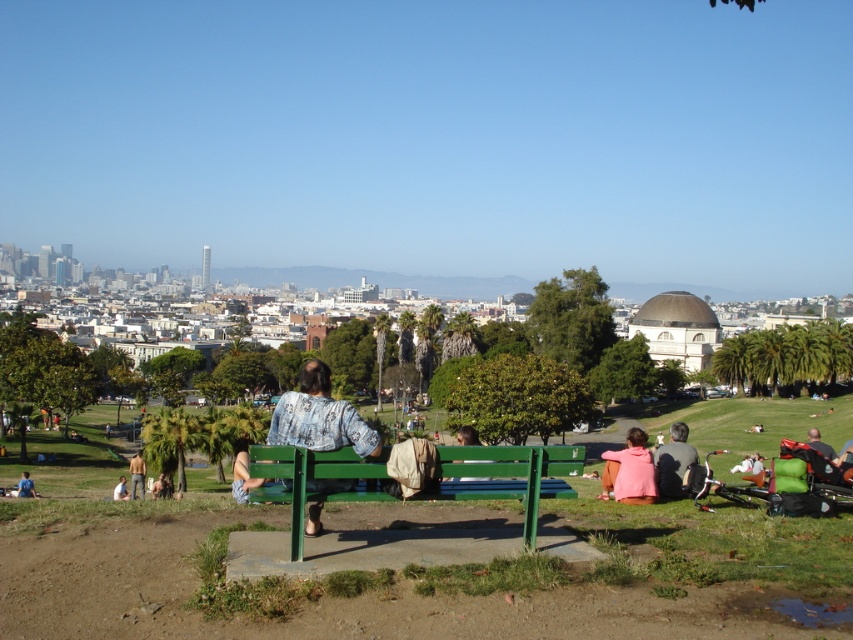
Question: Where is denim jacket at center located in relation to white fabric at lower left in the image?

Choices:
 (A) above
 (B) below

Answer: (A)

Question: Which point is closer to the camera?

Choices:
 (A) pink fleece jacket at lower right
 (B) white fabric at lower left
 (C) denim jacket at center

Answer: (C)

Question: Is green painted wood bench at center smaller than skinny man at lower left?

Choices:
 (A) no
 (B) yes

Answer: (B)

Question: Which of the following is the farthest from the observer?

Choices:
 (A) (254, 492)
 (B) (30, 483)
 (C) (463, 477)
 (D) (676, 468)

Answer: (B)

Question: Does light brown hair at center appear under skinny man at lower left?

Choices:
 (A) yes
 (B) no

Answer: (B)

Question: Among these points, which one is nearest to the camera?

Choices:
 (A) (683, 428)
 (B) (144, 467)
 (C) (167, 488)
 (D) (814, 445)

Answer: (D)